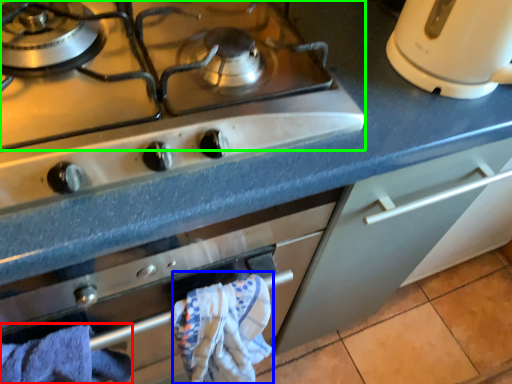
Question: Which object is positioned farthest from bath towel (highlighted by a red box)? Select from bath towel (highlighted by a blue box) and gas stove (highlighted by a green box).

Choices:
 (A) bath towel
 (B) gas stove

Answer: (B)